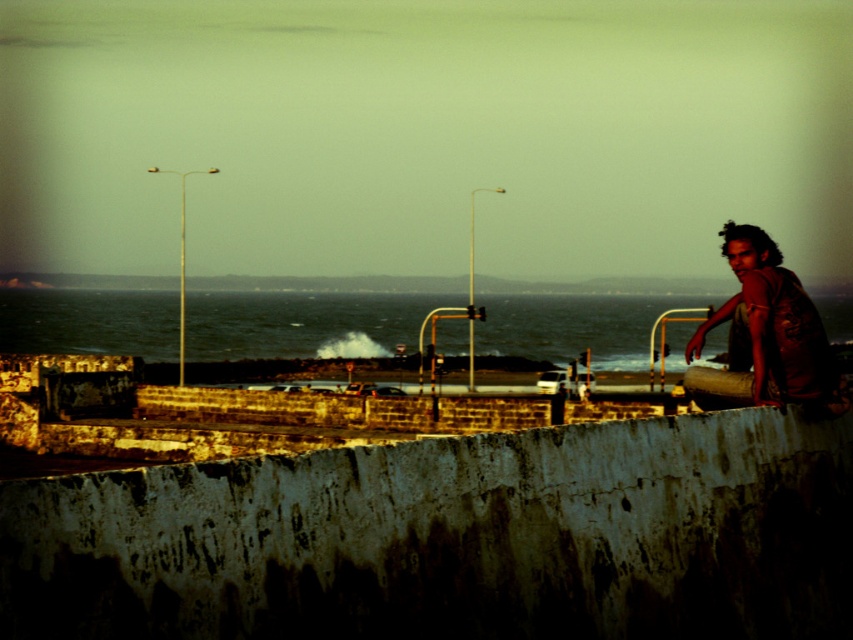
You are a photographer trying to capture the entire scene of the dark blue water at center and the brown textured shirt at right in one shot. Based on their sizes in the image, which object would appear larger in the photo?

The dark blue water at center appears larger in the photo because it is taller than the brown textured shirt at right.

You are a photographer setting up a shot of the coastal scene. You have two points marked on your viewfinder at coordinates point (717, 442) and point (848, 321). Which point should you focus on to ensure it appears sharper in the final image?

You should focus on point (717, 442) because it is closer to the camera and thus will be in focus more sharply than point (848, 321), which is further away.

You are standing at the camera position and want to place a 15 feet long temporary fence between you and the rusty concrete barrier at lower center. Is there enough space to fit the fence without it overlapping with the barrier?

The distance between the rusty concrete barrier at lower center and the camera is 17.08 feet. Since the fence is 15 feet long, there is sufficient space to place it between you and the barrier without overlapping.